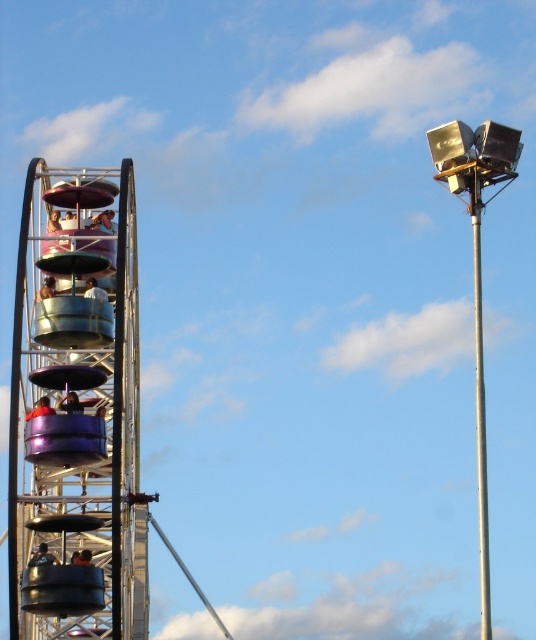
Question: Observing the image, what is the correct spatial positioning of metallic purple helmet at center in reference to matte purple seat at upper left?

Choices:
 (A) above
 (B) below

Answer: (B)

Question: Which of the following is the closest to the observer?

Choices:
 (A) matte purple seat at upper left
 (B) metallic purple helmet at center
 (C) silver metallic pole at right
 (D) light brown wooden chair at center

Answer: (B)

Question: Which point is closer to the camera taking this photo?

Choices:
 (A) (105, 412)
 (B) (55, 288)

Answer: (A)

Question: Observing the image, what is the correct spatial positioning of metallic purple helmet at center in reference to orange fabric seat at left?

Choices:
 (A) left
 (B) right

Answer: (B)

Question: Does metallic helmet at lower left appear on the left side of metallic blue helmet at left?

Choices:
 (A) no
 (B) yes

Answer: (A)

Question: Which point is farther to the camera?

Choices:
 (A) metallic purple ferris wheel at left
 (B) metallic purple ferris wheel car at upper left
 (C) silver metallic pole at right
 (D) orange fabric seat at left

Answer: (C)